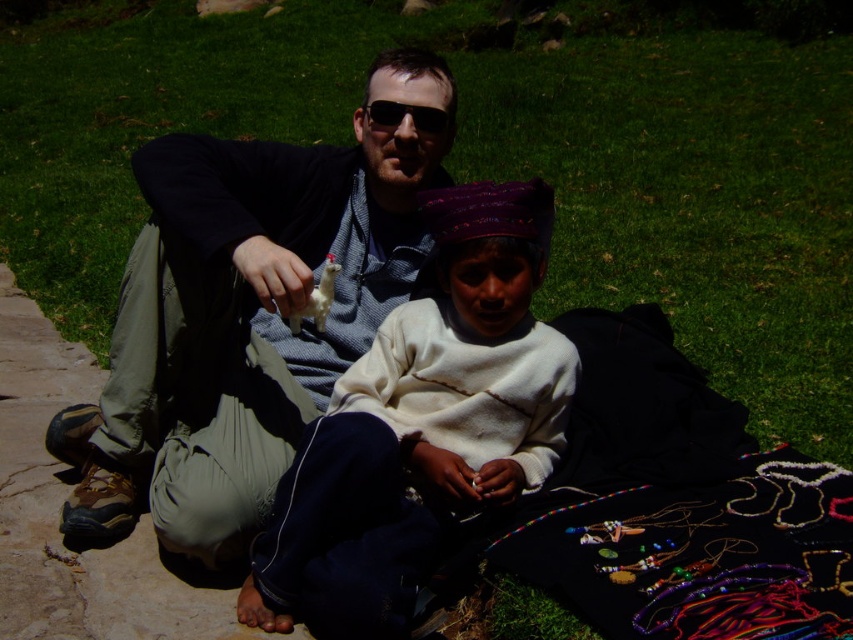
You are a photographer trying to capture a closeup shot of the white soft sweater at center and the black plastic sunglasses at center. Your camera can only focus on objects within a 60 cm range. Can you take a photo of both items without moving them?

The distance between the white soft sweater at center and the black plastic sunglasses at center is 77.63 centimeters, which exceeds the camera focus range of 60 cm. Therefore, you cannot take a photo of both items without moving them.

You are a photographer setting up a shoot in the scene described. You need to place a small prop exactly between the matte gray sweater at center and the black plastic sunglasses at center. Which object should you position the prop closer to, and why?

You should position the prop closer to the matte gray sweater at center because it is located to the left of the black plastic sunglasses at center, so the midpoint between them would be nearer to the sweater.